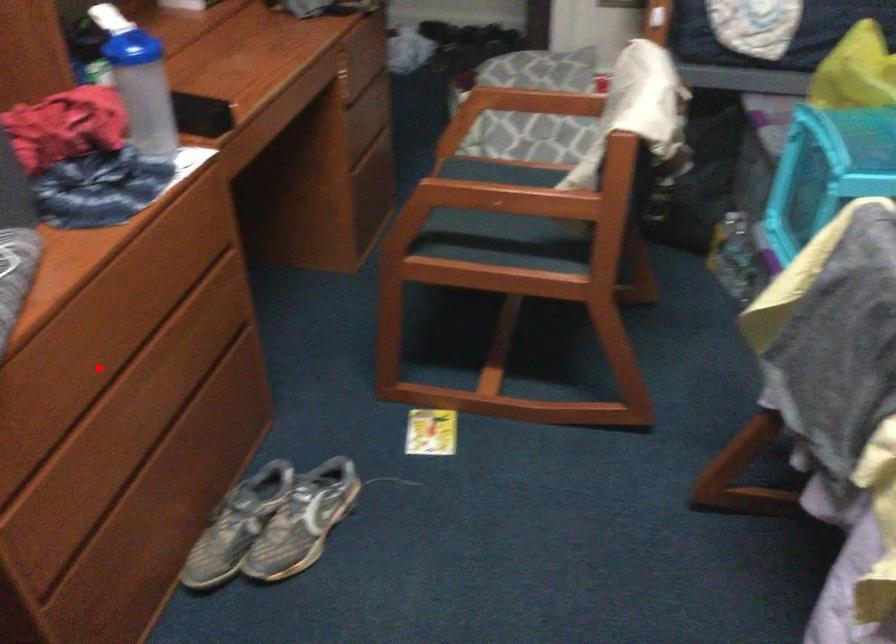
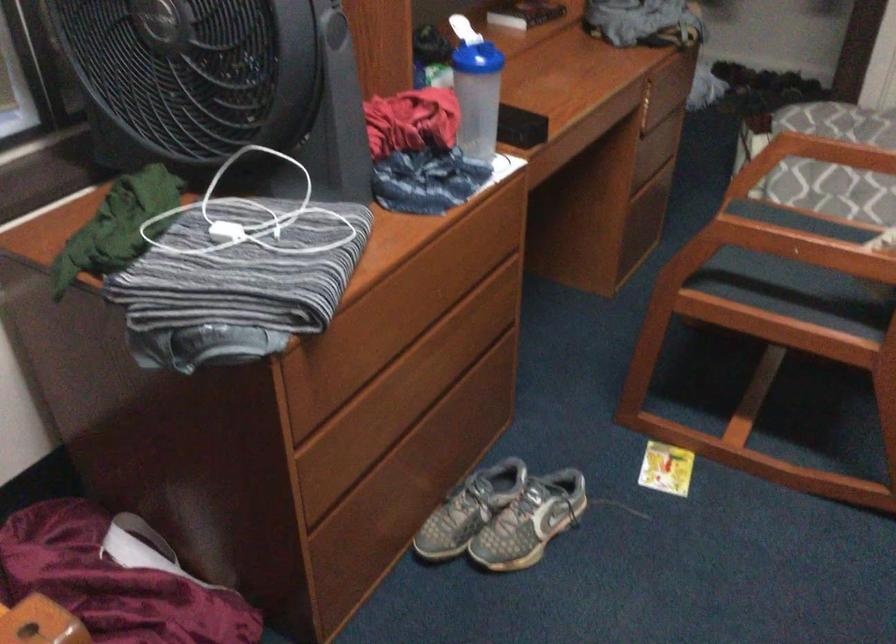
Locate, in the second image, the point that corresponds to the highlighted location in the first image.

(393, 339)